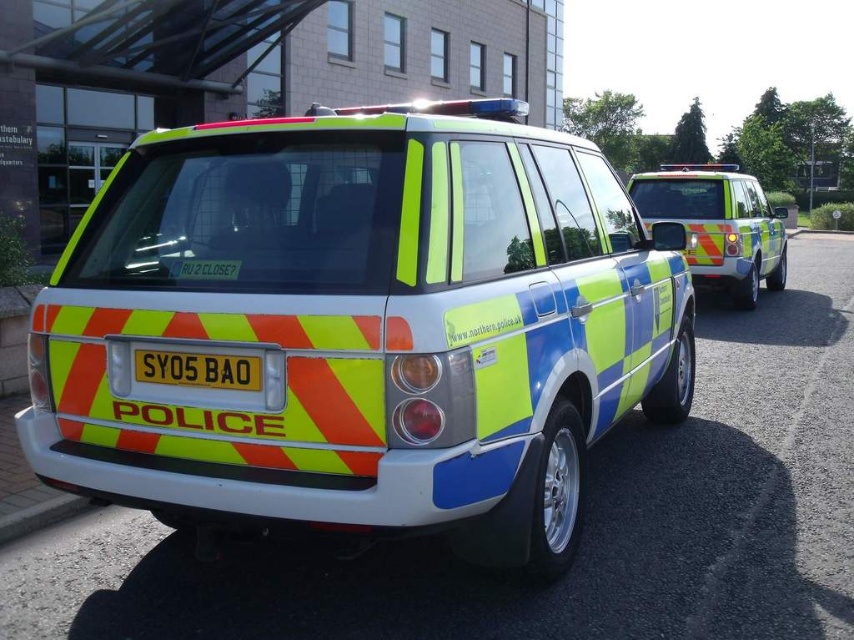
In the scene shown: You are a pedestrian standing at the point indicated by the coordinates point (x=358, y=326). You want to cross the road to reach the nearest police vehicle. Which police vehicle is closest to your current position?

The point (x=358, y=326) indicates reflective plastic police car at center, so the nearest police vehicle is the reflective plastic police car at center.

You are standing in front of the police vehicles and want to determine which of the two points, point (104, 333) or point (726, 164), is closer to you. Based on the scene, which point is nearer?

Point (104, 333) is closer to the viewer than point (726, 164).